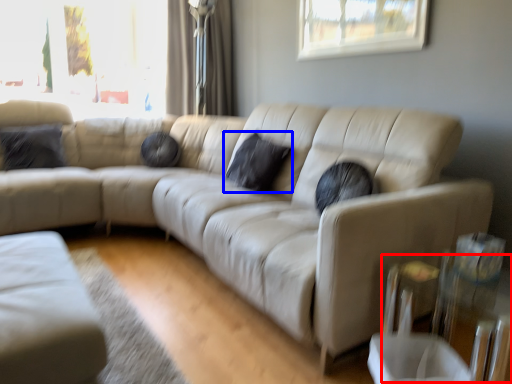
Question: Which of the following is the farthest to the observer, glass table (highlighted by a red box) or pillow (highlighted by a blue box)?

Choices:
 (A) glass table
 (B) pillow

Answer: (B)